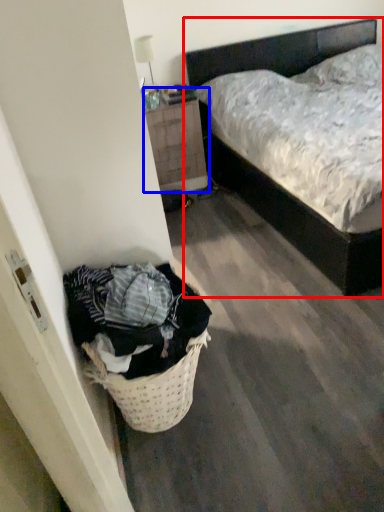
Question: Which point is closer to the camera, bed (highlighted by a red box) or nightstand (highlighted by a blue box)?

Choices:
 (A) bed
 (B) nightstand

Answer: (A)